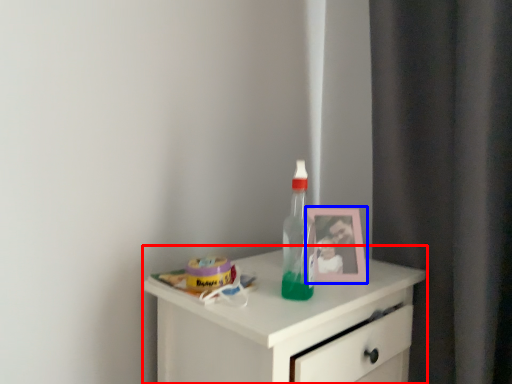
Question: Which point is further to the camera, chest of drawers (highlighted by a red box) or picture frame (highlighted by a blue box)?

Choices:
 (A) chest of drawers
 (B) picture frame

Answer: (B)